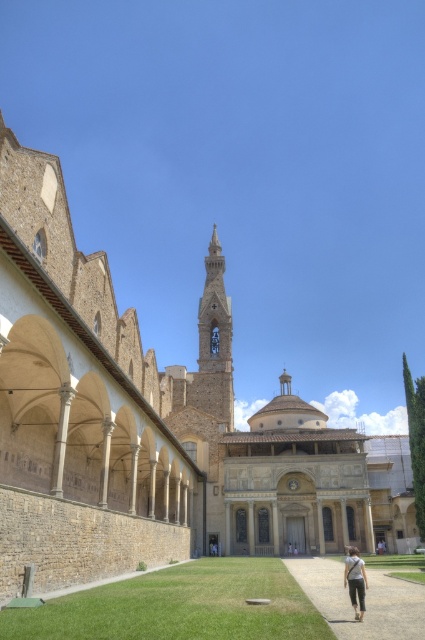
You are standing in the courtyard and want to walk towards the smooth stone tower at center. Which direction should you move relative to the green grass at lower center?

You should move to the left side of the green grass at lower center to reach the smooth stone tower at center since the green grass at lower center is positioned on the right side of smooth stone tower at center.

You are a gardener planning to mow the lawn. You see the green grass at lower center and the gravel path at center. Which area is wider?

The green grass at lower center is wider than the gravel path at center.

You are standing in the courtyard of the historic building and see the green grass at lower center and the light brown fabric pants at lower right. Which object takes up more space in the image?

The light brown fabric pants at lower right take up more space in the image than the green grass at lower center because the green grass at lower center is smaller than light brown fabric pants at lower right.